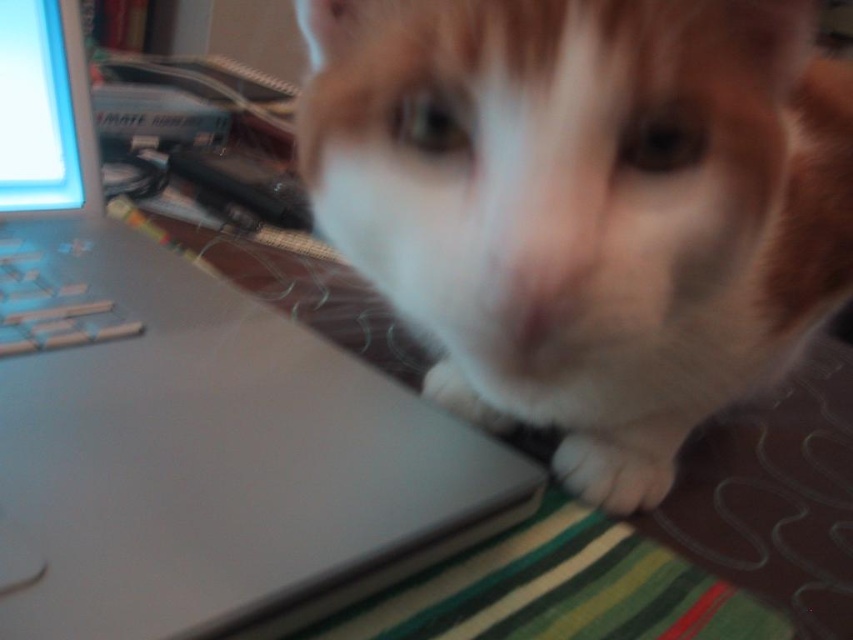
You are organizing your desk and want to place the satin silver keys at lower left next to the white fur cat at center. Considering their sizes, will the keys fit comfortably next to the cat without overlapping?

The white fur cat at center is wider than the satin silver keys at lower left, so the keys can fit comfortably next to the cat without overlapping since they are smaller in width.

You are trying to take a photo of the white fur cat at center and the matte silver laptop at upper left. Since the cat is blocking the view of the laptop, can you adjust your camera angle to capture both in the frame without moving either object?

The white fur cat at center is shorter than the matte silver laptop at upper left, so you can tilt the camera upwards to see over the cat and include both in the frame.

You are trying to place a 12 inch ruler on the desk in the image so that it reaches from the edge of the desk to the point at coordinates point (22,419). Will the ruler be long enough?

The distance of point (22,419) from viewer is 11.96 inches. The ruler is 12 inches long, so it will be just long enough to reach the point (22,419) from the edge of the desk.